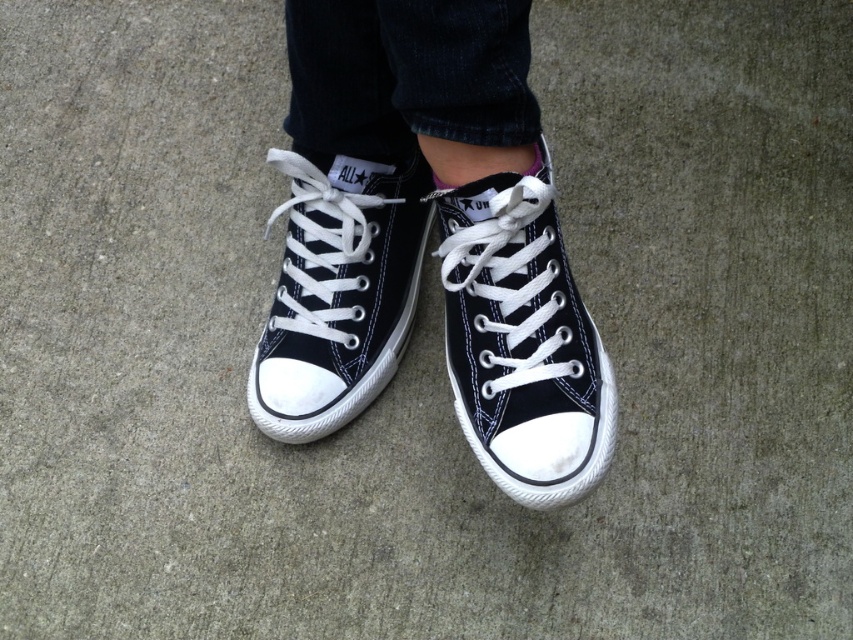
Which is below, black canvas sneakers at center or black canvas sneaker at center?

black canvas sneaker at center is lower down.

Which of these two, black canvas sneakers at center or black canvas sneaker at center, stands shorter?

black canvas sneaker at center is shorter.

Is point (372, 358) in front of point (300, 378)?

That is False.

This screenshot has width=853, height=640. Identify the location of black canvas sneakers at center. pyautogui.click(x=425, y=237).

Who is positioned more to the left, black canvas sneakers at center or black canvas shoe at center?

From the viewer's perspective, black canvas sneakers at center appears more on the left side.

Between black canvas sneakers at center and black canvas shoe at center, which one appears on the right side from the viewer's perspective?

black canvas shoe at center

What do you see at coordinates (425, 237) in the screenshot? I see `black canvas sneakers at center` at bounding box center [425, 237].

Locate an element on the screen. The height and width of the screenshot is (640, 853). black canvas sneakers at center is located at coordinates (425, 237).

Does black canvas shoe at center appear on the right side of black canvas sneaker at center?

Yes, black canvas shoe at center is to the right of black canvas sneaker at center.

Looking at this image, does black canvas shoe at center have a greater width compared to black canvas sneaker at center?

In fact, black canvas shoe at center might be narrower than black canvas sneaker at center.

Does point (585, 321) lie in front of point (354, 216)?

Yes, point (585, 321) is in front of point (354, 216).

Locate an element on the screen. The image size is (853, 640). black canvas shoe at center is located at coordinates (521, 339).